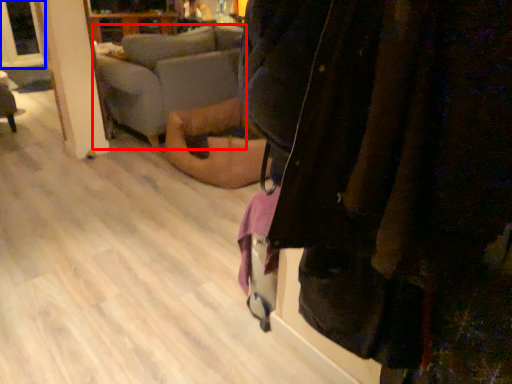
Question: Which of the following is the farthest to the observer, studio couch (highlighted by a red box) or window screen (highlighted by a blue box)?

Choices:
 (A) studio couch
 (B) window screen

Answer: (B)